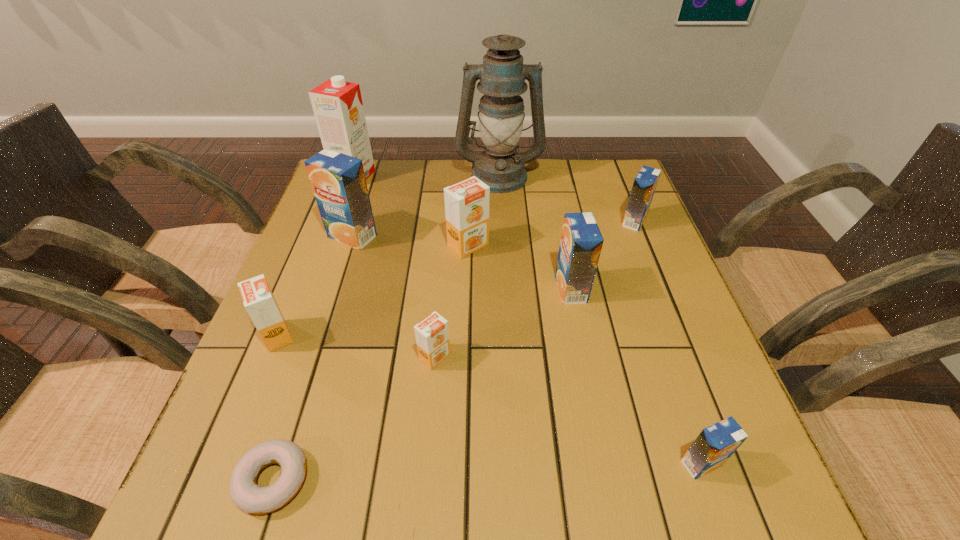
Where is `free point located on the front of the leftmost orange orange juice`? free point located on the front of the leftmost orange orange juice is located at coordinates (226, 465).

You are a GUI agent. You are given a task and a screenshot of the screen. Output one action in this format:
    pyautogui.click(x=<x>, y=<y>)
    Task: Click on the free space located 0.150m on the left of the smallest orange orange juice
    This screenshot has width=960, height=540.
    Given the screenshot: What is the action you would take?
    pyautogui.click(x=343, y=357)

Image resolution: width=960 pixels, height=540 pixels. In order to click on free space located on the back of the nearest orange_juice in this screenshot , I will do `click(642, 297)`.

The width and height of the screenshot is (960, 540). In order to click on free space located on the back of the brown doughnut in this screenshot , I will do `click(324, 320)`.

This screenshot has height=540, width=960. Identify the location of oil lamp present at the far edge. (502, 76).

Locate an element on the screen. This screenshot has height=540, width=960. carton located at the far edge is located at coordinates (338, 108).

Identify the location of orange_juice at the near edge. This screenshot has height=540, width=960. (716, 443).

I want to click on doughnut that is at the near edge, so click(x=249, y=497).

You are a GUI agent. You are given a task and a screenshot of the screen. Output one action in this format:
    pyautogui.click(x=<x>, y=<y>)
    Task: Click on the carton located in the left edge section of the desktop
    The width and height of the screenshot is (960, 540).
    Given the screenshot: What is the action you would take?
    pyautogui.click(x=338, y=108)

Find the location of a particular element. This screenshot has width=960, height=540. doughnut at the left edge is located at coordinates (249, 497).